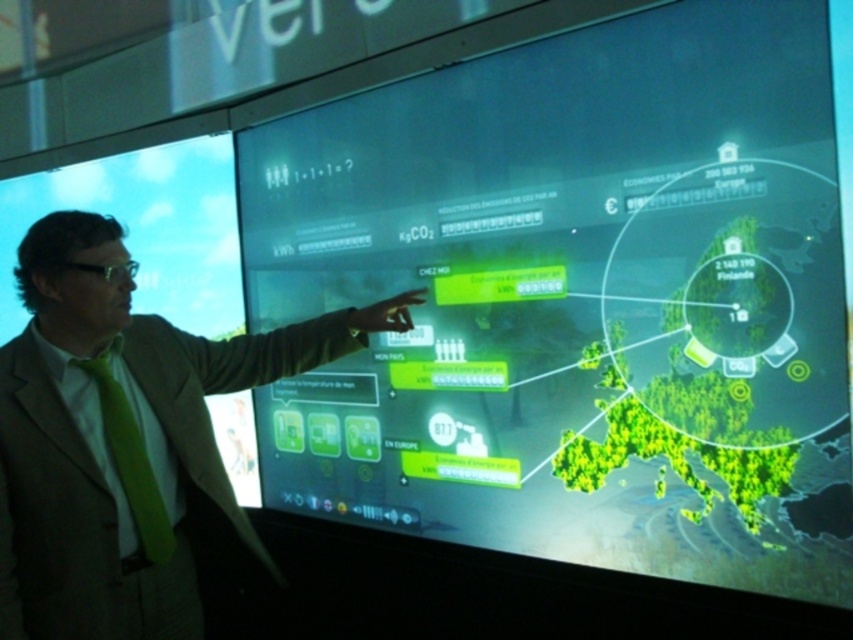
Question: Is green silk tie at left to the right of green matte tie at left from the viewer's perspective?

Choices:
 (A) no
 (B) yes

Answer: (B)

Question: Which point is farther to the camera?

Choices:
 (A) green matte tie at left
 (B) green silk tie at left
 (C) green matte map at center

Answer: (A)

Question: Based on their relative distances, which object is nearer to the green matte map at center?

Choices:
 (A) green silk tie at left
 (B) green matte tie at left

Answer: (A)

Question: Which is nearer to the green silk tie at left?

Choices:
 (A) green matte map at center
 (B) green matte tie at left

Answer: (B)

Question: Does green matte map at center have a greater width compared to green matte tie at left?

Choices:
 (A) no
 (B) yes

Answer: (B)

Question: Can you confirm if green matte map at center is positioned to the left of green matte tie at left?

Choices:
 (A) yes
 (B) no

Answer: (B)